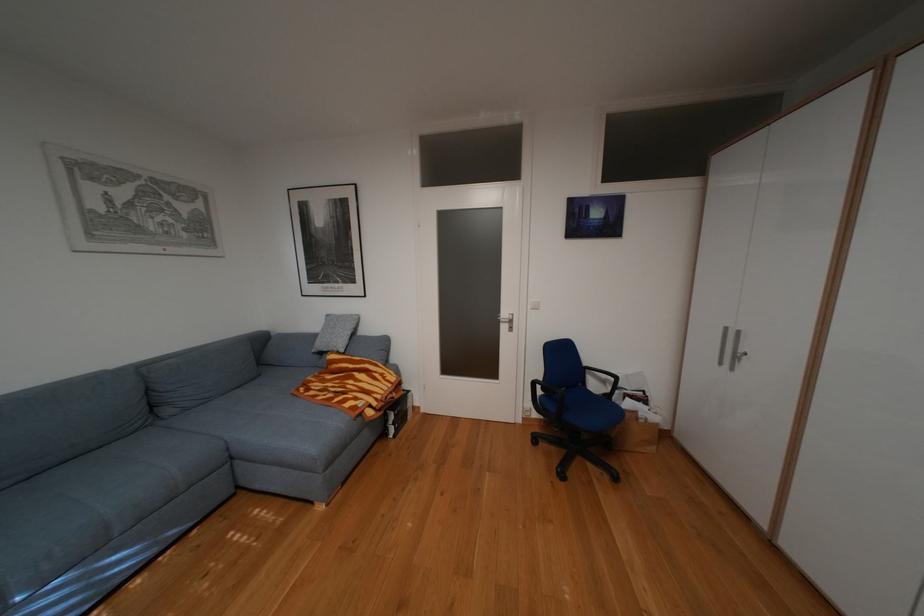
Locate an element on the screen. The height and width of the screenshot is (616, 924). white light switch is located at coordinates (533, 305).